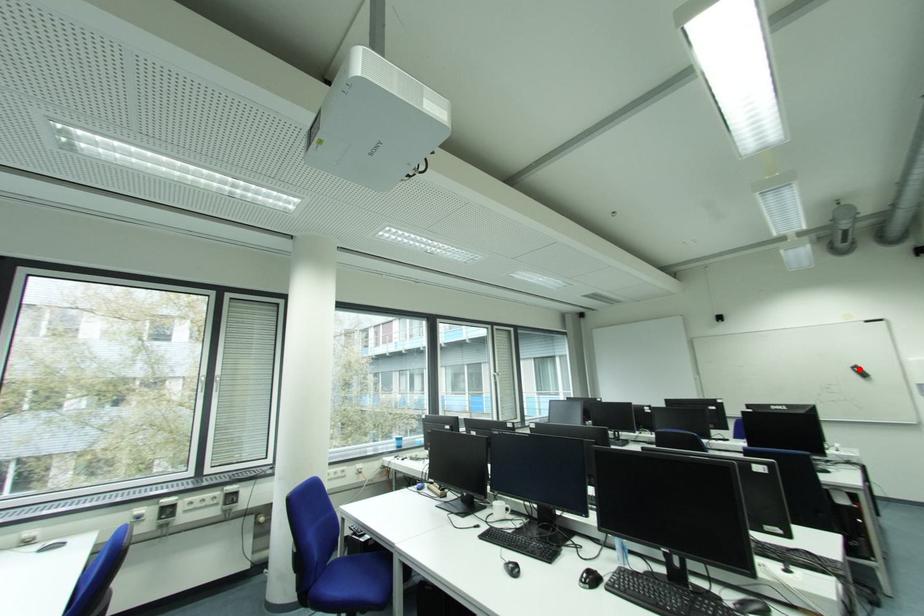
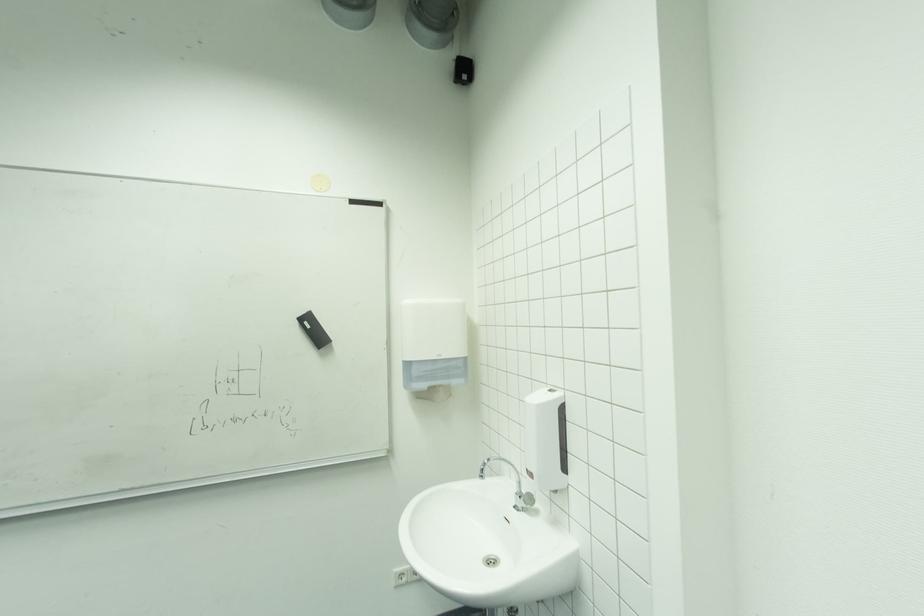
Locate, in the second image, the point that corresponds to the highlighted location in the first image.

(307, 321)